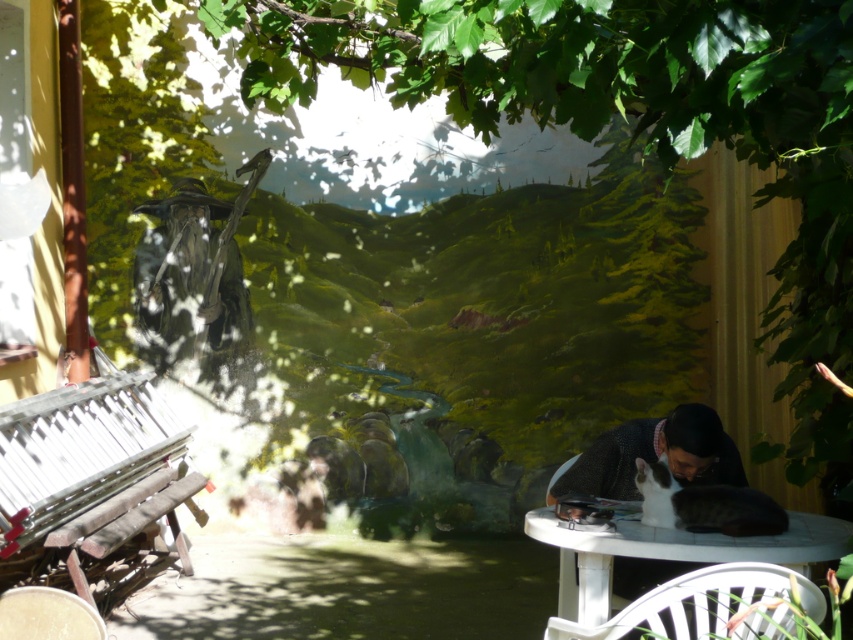
Who is positioned more to the right, white plastic table at lower right or white plastic chair at lower right?

white plastic table at lower right is more to the right.

How much distance is there between white plastic table at lower right and white plastic chair at lower right?

14.48 inches

Does point (816, 532) lie behind point (714, 566)?

Yes, it is behind point (714, 566).

Find the location of a particular element. This screenshot has width=853, height=640. white plastic table at lower right is located at coordinates (672, 552).